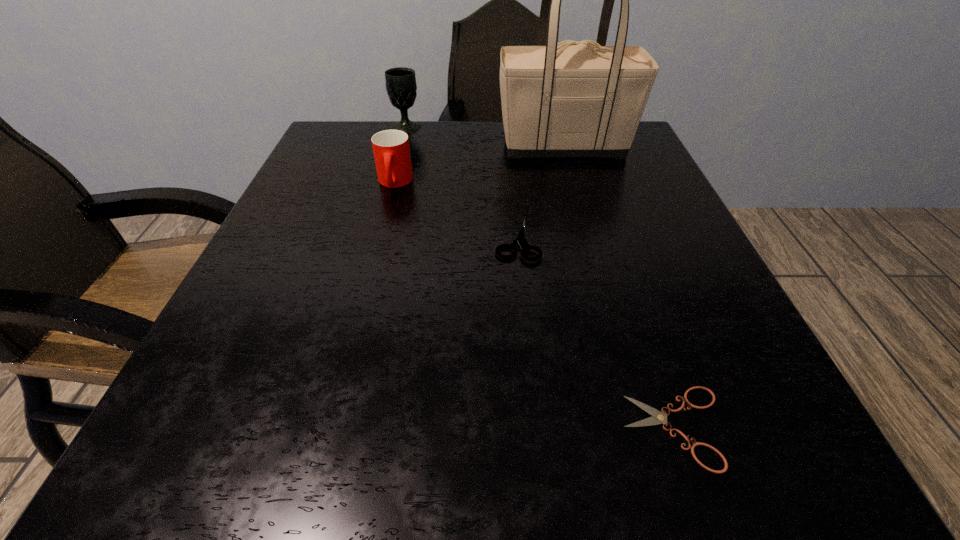
In order to click on vacant space at the right edge in this screenshot , I will do `click(615, 185)`.

Locate an element on the screen. vacant space at the near left corner is located at coordinates (151, 480).

You are a GUI agent. You are given a task and a screenshot of the screen. Output one action in this format:
    pyautogui.click(x=<x>, y=<y>)
    Task: Click on the vacant area that lies between the fourth shortest object and the taller shears
    This screenshot has width=960, height=540.
    Given the screenshot: What is the action you would take?
    pyautogui.click(x=462, y=184)

Locate an element on the screen. vacant space that is in between the tallest object and the shortest object is located at coordinates (620, 287).

Identify the location of free spot between the shorter shears and the tallest object. The image size is (960, 540). (620, 287).

Identify the location of free space between the shopping bag and the third tallest object. Image resolution: width=960 pixels, height=540 pixels. (479, 165).

The width and height of the screenshot is (960, 540). Identify the location of vacant space in between the left shears and the shopping bag. (540, 194).

Find the location of a particular element. The image size is (960, 540). free space between the right shears and the farther shears is located at coordinates (596, 334).

Find the location of a particular element. free area in between the right shears and the cup is located at coordinates (536, 305).

This screenshot has height=540, width=960. In order to click on blank region between the nearest object and the shopping bag in this screenshot , I will do `click(620, 287)`.